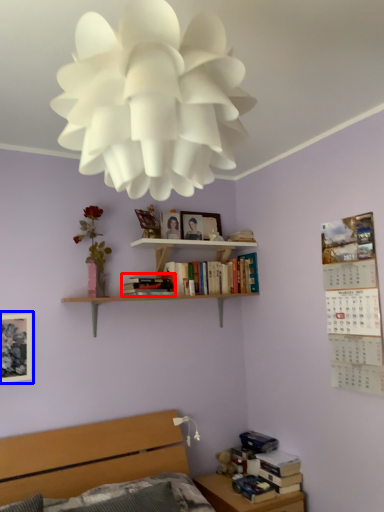
Question: Among these objects, which one is farthest to the camera, book (highlighted by a red box) or picture frame (highlighted by a blue box)?

Choices:
 (A) book
 (B) picture frame

Answer: (A)